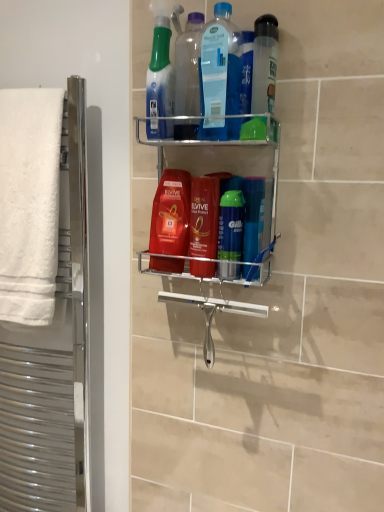
Question: From the image's perspective, is blue translucent bottle at upper center, placed as the second cleaning product when sorted from bottom to top, below shiny orange shampoo at center, placed as the 1th cleaning product when sorted from bottom to top?

Choices:
 (A) no
 (B) yes

Answer: (A)

Question: Does blue translucent bottle at upper center, arranged as the second cleaning product when viewed from the top, have a lesser height compared to shiny orange shampoo at center, placed as the 1th cleaning product when sorted from bottom to top?

Choices:
 (A) yes
 (B) no

Answer: (B)

Question: Is blue translucent bottle at upper center, arranged as the second cleaning product when viewed from the top, thinner than shiny orange shampoo at center, placed as the 1th cleaning product when sorted from bottom to top?

Choices:
 (A) no
 (B) yes

Answer: (B)

Question: Does blue translucent bottle at upper center, arranged as the second cleaning product when viewed from the top, come in front of shiny orange shampoo at center, placed as the 1th cleaning product when sorted from bottom to top?

Choices:
 (A) no
 (B) yes

Answer: (B)

Question: Does blue translucent bottle at upper center, placed as the second cleaning product when sorted from bottom to top, have a smaller size compared to shiny orange shampoo at center, placed as the 3th cleaning product when sorted from top to bottom?

Choices:
 (A) yes
 (B) no

Answer: (A)

Question: Is blue translucent bottle at upper center, arranged as the second cleaning product when viewed from the top, completely or partially outside of shiny orange shampoo at center, placed as the 1th cleaning product when sorted from bottom to top?

Choices:
 (A) no
 (B) yes

Answer: (B)

Question: Is metallic silver shelf at center to the right of clear plastic bottle at upper center, the 1th mouthwash from the right, from the viewer's perspective?

Choices:
 (A) yes
 (B) no

Answer: (B)

Question: Can you confirm if metallic silver shelf at center is smaller than clear plastic bottle at upper center, the 1th mouthwash from the right?

Choices:
 (A) no
 (B) yes

Answer: (A)

Question: Does metallic silver shelf at center lie in front of clear plastic bottle at upper center, the fourth mouthwash from the left?

Choices:
 (A) no
 (B) yes

Answer: (B)

Question: From a real-world perspective, is metallic silver shelf at center located beneath clear plastic bottle at upper center, the 1th mouthwash from the right?

Choices:
 (A) no
 (B) yes

Answer: (B)

Question: Is metallic silver shelf at center not inside clear plastic bottle at upper center, the 1th mouthwash from the right?

Choices:
 (A) no
 (B) yes

Answer: (B)

Question: Is metallic silver shelf at center in contact with clear plastic bottle at upper center, the 1th mouthwash from the right?

Choices:
 (A) yes
 (B) no

Answer: (B)

Question: Can you confirm if red glossy mouthwash at center, the 1th mouthwash viewed from the left, is shorter than transparent plastic bottle at upper center?

Choices:
 (A) no
 (B) yes

Answer: (B)